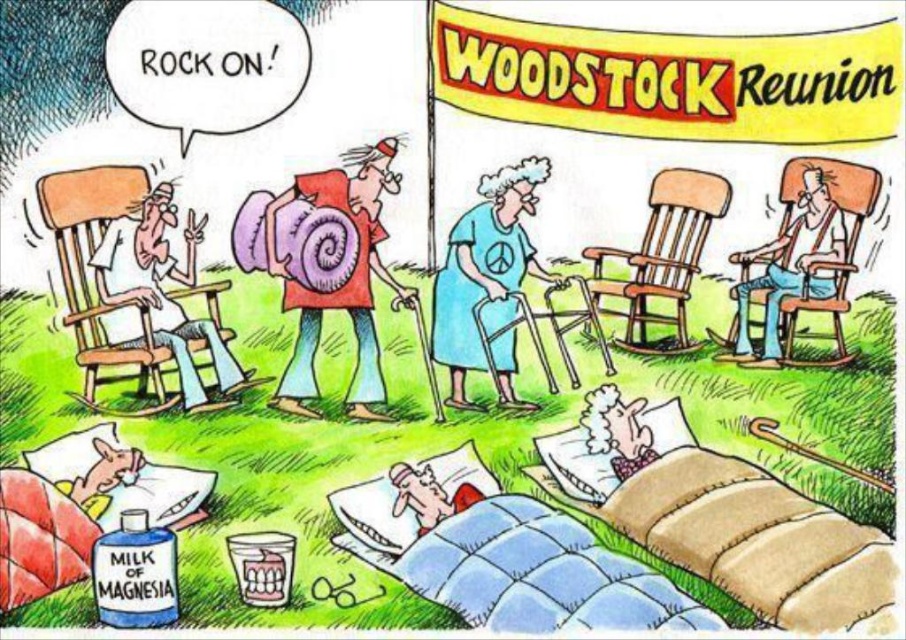
In the scene shown: Can you confirm if matte red shirt at center is wider than white fabric shirt at left?

No.

Is matte red shirt at center closer to the viewer compared to white fabric shirt at left?

No, matte red shirt at center is behind white fabric shirt at left.

I want to click on matte red shirt at center, so click(342, 284).

Where is `matte red shirt at center`? Image resolution: width=906 pixels, height=640 pixels. matte red shirt at center is located at coordinates (342, 284).

How much distance is there between white fabric shirt at left and pink fabric pillow at lower center?

white fabric shirt at left and pink fabric pillow at lower center are 2.55 meters apart from each other.

Is white fabric shirt at left to the left of pink fabric pillow at lower center from the viewer's perspective?

Yes, white fabric shirt at left is to the left of pink fabric pillow at lower center.

Which is in front, point (153, 221) or point (420, 465)?

Point (420, 465) is more forward.

The image size is (906, 640). In order to click on white fabric shirt at left in this screenshot , I will do `click(158, 291)`.

Between smooth brown chair at right and pink fabric pillow at lower center, which one appears on the right side from the viewer's perspective?

smooth brown chair at right is more to the right.

Can you confirm if smooth brown chair at right is wider than pink fabric pillow at lower center?

Yes, smooth brown chair at right is wider than pink fabric pillow at lower center.

Is point (808, 236) positioned after point (408, 467)?

Yes, point (808, 236) is behind point (408, 467).

The image size is (906, 640). I want to click on smooth brown chair at right, so click(x=791, y=268).